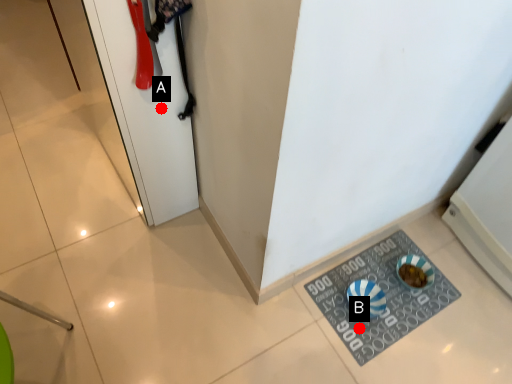
Question: Two points are circled on the image, labeled by A and B beside each circle. Which point is closer to the camera taking this photo?

Choices:
 (A) A is closer
 (B) B is closer

Answer: (A)